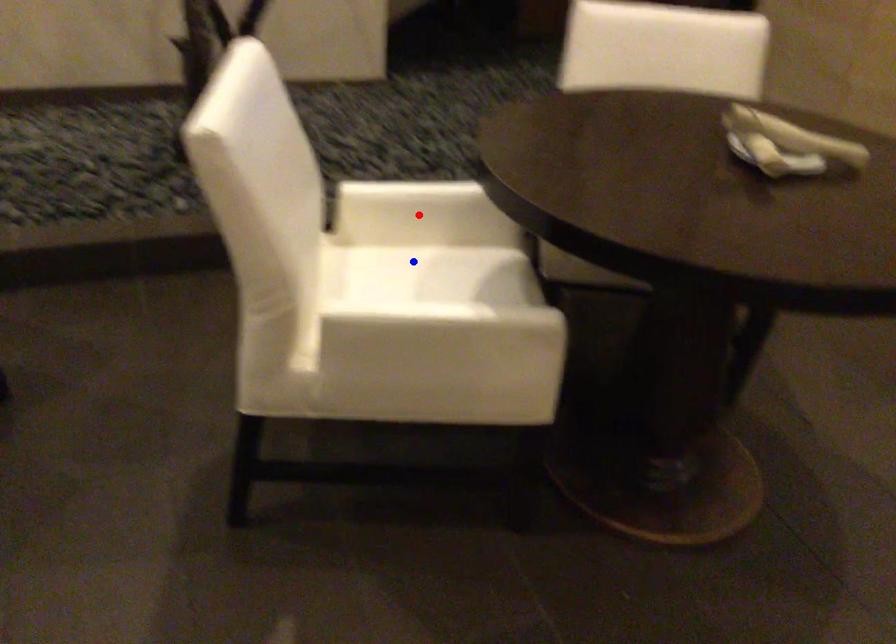
Question: In the image, two points are highlighted. Which point is nearer to the camera? Reply with the corresponding letter.

Choices:
 (A) blue point
 (B) red point

Answer: (A)